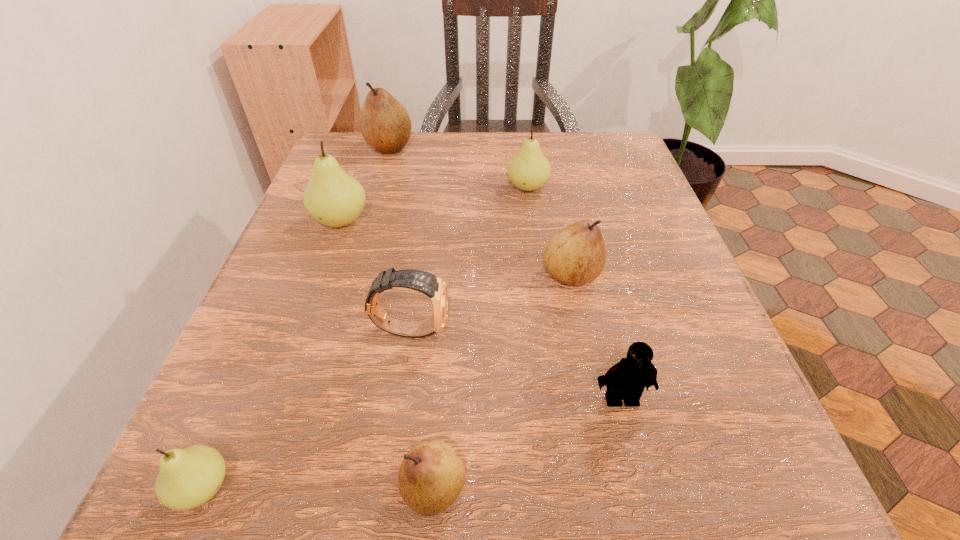
Where is `the closest green pear relative to the third farthest pear`? the closest green pear relative to the third farthest pear is located at coordinates (528, 170).

Locate an element on the screen. This screenshot has height=540, width=960. green pear that can be found as the third closest to the biggest brown pear is located at coordinates (187, 478).